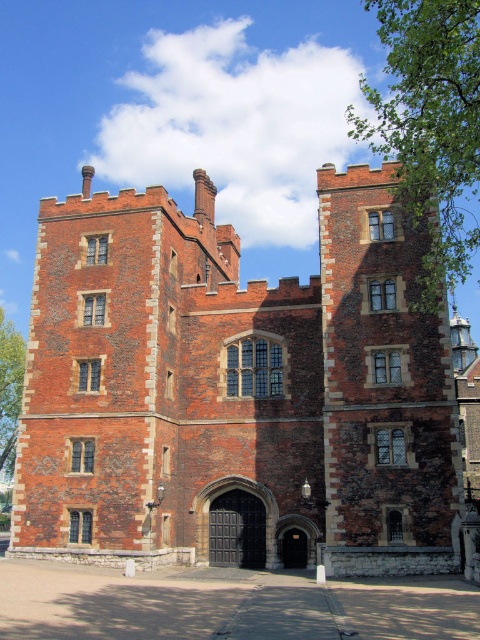
Find the location of `dark brown wooden gate at center`. dark brown wooden gate at center is located at coordinates (237, 531).

Between point (223, 504) and point (295, 540), which one is positioned behind?

Point (223, 504)

At what (x,y) coordinates should I click in order to perform the action: click on dark brown wooden gate at center. Please return your answer as a coordinate pair (x, y). Looking at the image, I should click on (237, 531).

How much distance is there between brick stone castle at center and smooth stone archway at center?

A distance of 13.67 meters exists between brick stone castle at center and smooth stone archway at center.

Between brick stone castle at center and smooth stone archway at center, which one has more height?

brick stone castle at center is taller.

What are the coordinates of `brick stone castle at center` in the screenshot? It's located at (235, 387).

Who is shorter, brick stone castle at center or dark brown wooden gate at center?

Standing shorter between the two is dark brown wooden gate at center.

Which is behind, point (231, 230) or point (254, 540)?

Positioned behind is point (231, 230).

Describe the element at coordinates (235, 387) in the screenshot. This screenshot has width=480, height=640. I see `brick stone castle at center` at that location.

Identify the location of brick stone castle at center. (235, 387).